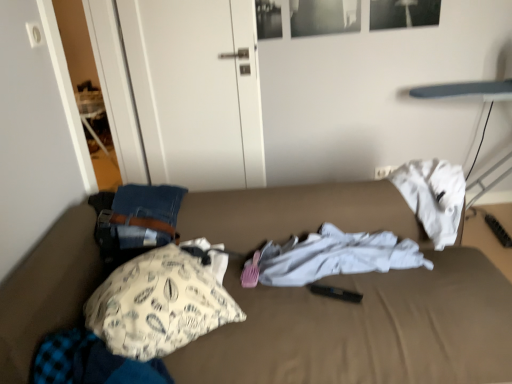
Question: Does white cotton shirt at center, positioned as the 1th clothing in right-to-left order, have a lesser height compared to fluffy blue blanket at lower left, the 1th clothing in the left-to-right sequence?

Choices:
 (A) yes
 (B) no

Answer: (A)

Question: Considering the relative positions of white cotton shirt at center, which ranks as the second clothing in left-to-right order, and fluffy blue blanket at lower left, arranged as the second clothing when viewed from the back, in the image provided, is white cotton shirt at center, which ranks as the second clothing in left-to-right order, to the left of fluffy blue blanket at lower left, arranged as the second clothing when viewed from the back, from the viewer's perspective?

Choices:
 (A) yes
 (B) no

Answer: (B)

Question: Is white cotton shirt at center, which ranks as the second clothing in left-to-right order, beside fluffy blue blanket at lower left, placed as the first clothing when sorted from front to back?

Choices:
 (A) yes
 (B) no

Answer: (B)

Question: Can you confirm if white cotton shirt at center, positioned as the 1th clothing in right-to-left order, is taller than fluffy blue blanket at lower left, the 1th clothing in the bottom-to-top sequence?

Choices:
 (A) yes
 (B) no

Answer: (B)

Question: Is white cotton shirt at center, the 1th clothing positioned from the back, positioned beyond the bounds of fluffy blue blanket at lower left, the 1th clothing in the left-to-right sequence?

Choices:
 (A) no
 (B) yes

Answer: (B)

Question: Is fluffy blue blanket at lower left, the 1th clothing in the bottom-to-top sequence, at the back of white cotton shirt at center, the 1th clothing in the top-to-bottom sequence?

Choices:
 (A) no
 (B) yes

Answer: (A)

Question: Is white printed fabric pillow at left placed right next to white cotton shirt at center, the 1th clothing in the top-to-bottom sequence?

Choices:
 (A) no
 (B) yes

Answer: (A)

Question: From a real-world perspective, is white printed fabric pillow at left located beneath white cotton shirt at center, the 1th clothing positioned from the back?

Choices:
 (A) no
 (B) yes

Answer: (A)

Question: Does white printed fabric pillow at left appear on the left side of white cotton shirt at center, which ranks as the second clothing in left-to-right order?

Choices:
 (A) no
 (B) yes

Answer: (B)

Question: Is white printed fabric pillow at left wider than white cotton shirt at center, which ranks as the second clothing in left-to-right order?

Choices:
 (A) no
 (B) yes

Answer: (B)

Question: Is white printed fabric pillow at left taller than white cotton shirt at center, the 1th clothing positioned from the back?

Choices:
 (A) yes
 (B) no

Answer: (A)

Question: From the image's perspective, does white printed fabric pillow at left appear lower than white cotton shirt at center, placed as the second clothing when sorted from front to back?

Choices:
 (A) yes
 (B) no

Answer: (A)

Question: Is fluffy blue blanket at lower left, placed as the first clothing when sorted from front to back, thinner than white matte door at upper left?

Choices:
 (A) yes
 (B) no

Answer: (B)